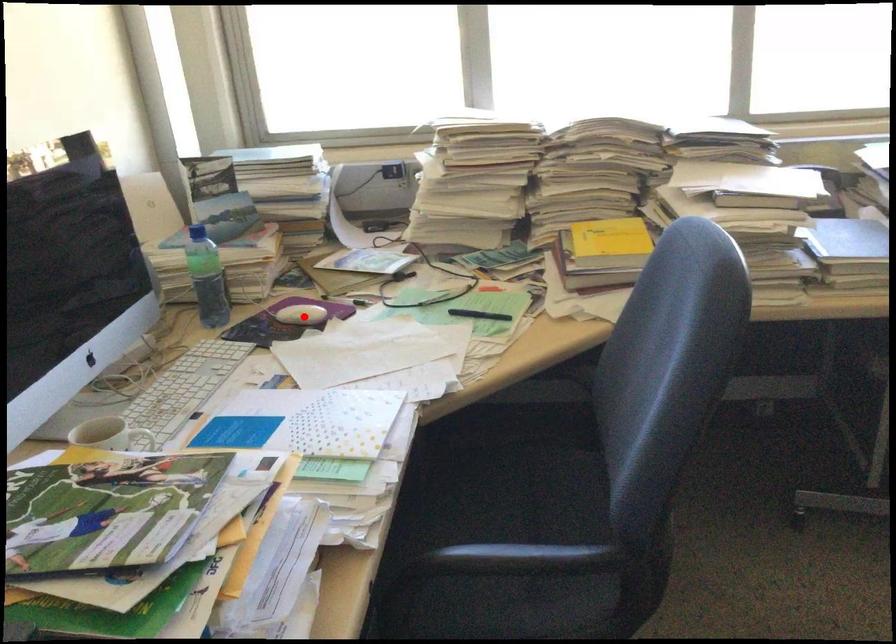
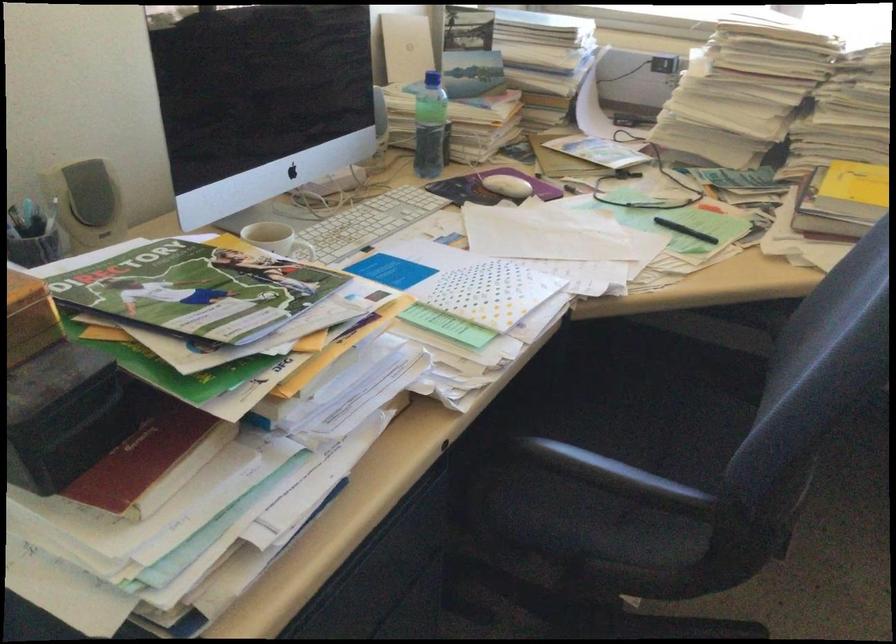
Find the pixel in the second image that matches the highlighted location in the first image.

(506, 185)